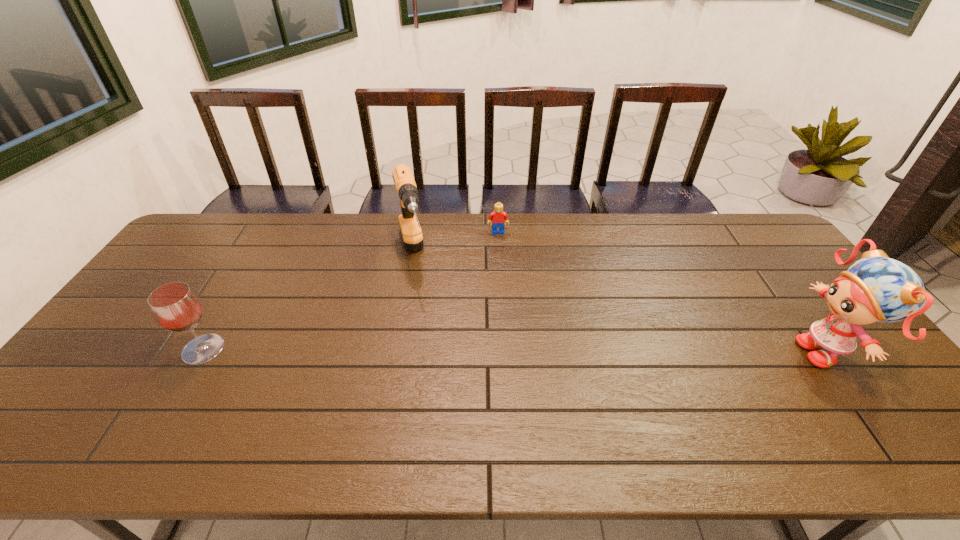
The height and width of the screenshot is (540, 960). Find the location of `wineglass`. wineglass is located at coordinates (176, 307).

Identify the location of the second shortest object. (176, 307).

Find the location of `the rightmost object`. the rightmost object is located at coordinates (876, 288).

Where is `the shortest object`? This screenshot has width=960, height=540. the shortest object is located at coordinates (498, 216).

Where is `the third object from left to right`? This screenshot has height=540, width=960. the third object from left to right is located at coordinates (498, 216).

Locate an element on the screen. Image resolution: width=960 pixels, height=540 pixels. drill is located at coordinates (411, 232).

Locate an element on the screen. vacant space located 0.080m on the back of the second shortest object is located at coordinates (225, 313).

You are a GUI agent. You are given a task and a screenshot of the screen. Output one action in this format:
    pyautogui.click(x=<x>, y=<y>)
    Task: Click on the vacant space located on the face of the doll
    This screenshot has height=540, width=960.
    Given the screenshot: What is the action you would take?
    pyautogui.click(x=755, y=351)

Where is `vacant area situated 0.310m on the face of the doll`? The width and height of the screenshot is (960, 540). vacant area situated 0.310m on the face of the doll is located at coordinates (679, 351).

Find the location of `vacant space located on the face of the doll`. vacant space located on the face of the doll is located at coordinates (755, 351).